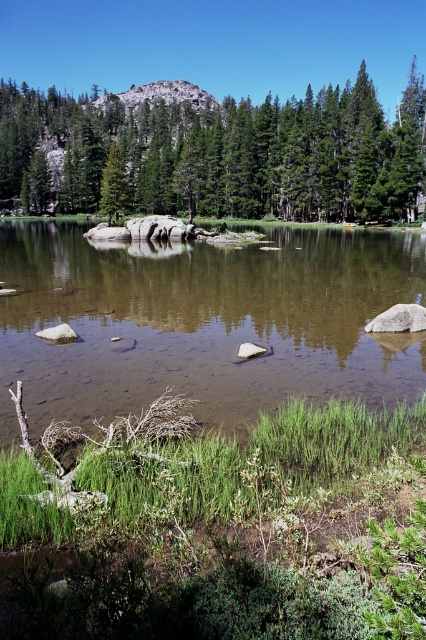
Question: From the image, what is the correct spatial relationship of green matte tree at upper center in relation to green matte tree at center?

Choices:
 (A) above
 (B) below

Answer: (A)

Question: Does green matte tree at upper center appear on the left side of green matte tree at center?

Choices:
 (A) yes
 (B) no

Answer: (A)

Question: Which point is closer to the camera?

Choices:
 (A) green matte tree at center
 (B) brown smooth water at center

Answer: (B)

Question: Is green matte tree at upper center below green matte tree at center?

Choices:
 (A) yes
 (B) no

Answer: (B)

Question: Which point is farther to the camera?

Choices:
 (A) green matte tree at center
 (B) green matte tree at upper center

Answer: (B)

Question: Estimate the real-world distances between objects in this image. Which object is closer to the brown smooth water at center?

Choices:
 (A) green matte tree at upper center
 (B) green matte tree at center

Answer: (B)